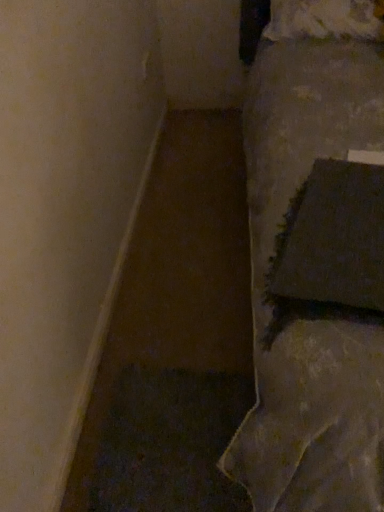
The width and height of the screenshot is (384, 512). I want to click on dark fabric pillow at right, marked as the 1th pillow in a bottom-to-top arrangement, so click(x=337, y=238).

Consider the image. In order to face dark fabric pillow at right, the second pillow in the back-to-front sequence, should I rotate leftwards or rightwards?

Rotate your view right by about 19.527°.

What do you see at coordinates (337, 238) in the screenshot?
I see `dark fabric pillow at right, the first pillow in the front-to-back sequence` at bounding box center [337, 238].

What is the approximate width of dark fabric pillow at right, the first pillow in the front-to-back sequence?

dark fabric pillow at right, the first pillow in the front-to-back sequence, is 15.73 inches wide.

Locate an element on the screen. Image resolution: width=384 pixels, height=512 pixels. white fluffy pillow at upper right, the 1th pillow positioned from the top is located at coordinates (326, 19).

What do you see at coordinates (326, 19) in the screenshot?
I see `white fluffy pillow at upper right, the 1th pillow positioned from the top` at bounding box center [326, 19].

The width and height of the screenshot is (384, 512). Identify the location of dark fabric pillow at right, the 2th pillow when ordered from top to bottom. (337, 238).

Does dark fabric pillow at right, the first pillow in the front-to-back sequence, appear on the left side of white fluffy pillow at upper right, which is the second pillow from front to back?

Correct, you'll find dark fabric pillow at right, the first pillow in the front-to-back sequence, to the left of white fluffy pillow at upper right, which is the second pillow from front to back.

Is dark fabric pillow at right, marked as the 1th pillow in a bottom-to-top arrangement, closer to the viewer compared to white fluffy pillow at upper right, which ranks as the 1th pillow in back-to-front order?

That is True.

Which point is more distant from viewer, (365, 228) or (309, 2)?

Positioned behind is point (309, 2).

From the image's perspective, is dark fabric pillow at right, the second pillow in the back-to-front sequence, located above or below white fluffy pillow at upper right, which is the second pillow from front to back?

From the image's perspective, dark fabric pillow at right, the second pillow in the back-to-front sequence, appears below white fluffy pillow at upper right, which is the second pillow from front to back.

From a real-world perspective, between dark fabric pillow at right, the first pillow in the front-to-back sequence, and white fluffy pillow at upper right, which ranks as the 1th pillow in back-to-front order, who is vertically higher?

In real-world perspective, white fluffy pillow at upper right, which ranks as the 1th pillow in back-to-front order, is above.

Between dark fabric pillow at right, the 2th pillow when ordered from top to bottom, and white fluffy pillow at upper right, which is the second pillow from front to back, which one has larger width?

dark fabric pillow at right, the 2th pillow when ordered from top to bottom, is wider.

Is dark fabric pillow at right, the first pillow in the front-to-back sequence, shorter than white fluffy pillow at upper right, the 1th pillow positioned from the top?

Correct, dark fabric pillow at right, the first pillow in the front-to-back sequence, is not as tall as white fluffy pillow at upper right, the 1th pillow positioned from the top.

Who is smaller, dark fabric pillow at right, the second pillow in the back-to-front sequence, or white fluffy pillow at upper right, which ranks as the 1th pillow in back-to-front order?

dark fabric pillow at right, the second pillow in the back-to-front sequence.

Is dark fabric pillow at right, the first pillow in the front-to-back sequence, located outside white fluffy pillow at upper right, which is the second pillow from front to back?

Indeed, dark fabric pillow at right, the first pillow in the front-to-back sequence, is completely outside white fluffy pillow at upper right, which is the second pillow from front to back.

Does dark fabric pillow at right, the first pillow in the front-to-back sequence, touch white fluffy pillow at upper right, which is the second pillow from front to back?

No, dark fabric pillow at right, the first pillow in the front-to-back sequence, is not next to white fluffy pillow at upper right, which is the second pillow from front to back.

Is dark fabric pillow at right, the second pillow in the back-to-front sequence, positioned with its back to white fluffy pillow at upper right, the 1th pillow positioned from the top?

Absolutely, dark fabric pillow at right, the second pillow in the back-to-front sequence, is directed away from white fluffy pillow at upper right, the 1th pillow positioned from the top.

Can you tell me how much dark fabric pillow at right, the 2th pillow when ordered from top to bottom, and white fluffy pillow at upper right, marked as the second pillow in a bottom-to-top arrangement, differ in facing direction?

17.3 degrees separate the facing orientations of dark fabric pillow at right, the 2th pillow when ordered from top to bottom, and white fluffy pillow at upper right, marked as the second pillow in a bottom-to-top arrangement.

At what (x,y) coordinates should I click in order to perform the action: click on pillow located on the right of dark fabric pillow at right, the second pillow in the back-to-front sequence. Please return your answer as a coordinate pair (x, y). Looking at the image, I should click on (326, 19).

Considering the positions of objects white fluffy pillow at upper right, which ranks as the 1th pillow in back-to-front order, and dark fabric pillow at right, marked as the 1th pillow in a bottom-to-top arrangement, in the image provided, who is more to the left, white fluffy pillow at upper right, which ranks as the 1th pillow in back-to-front order, or dark fabric pillow at right, marked as the 1th pillow in a bottom-to-top arrangement,?

dark fabric pillow at right, marked as the 1th pillow in a bottom-to-top arrangement, is more to the left.

Does white fluffy pillow at upper right, which ranks as the 1th pillow in back-to-front order, come in front of dark fabric pillow at right, the 2th pillow when ordered from top to bottom?

That is False.

Does point (323, 34) come farther from viewer compared to point (365, 294)?

Yes, it is.

From the image's perspective, is white fluffy pillow at upper right, which ranks as the 1th pillow in back-to-front order, under dark fabric pillow at right, marked as the 1th pillow in a bottom-to-top arrangement?

Incorrect, from the image's perspective, white fluffy pillow at upper right, which ranks as the 1th pillow in back-to-front order, is higher than dark fabric pillow at right, marked as the 1th pillow in a bottom-to-top arrangement.

From a real-world perspective, is white fluffy pillow at upper right, the 1th pillow positioned from the top, over dark fabric pillow at right, the 2th pillow when ordered from top to bottom?

Yes, from a real-world perspective, white fluffy pillow at upper right, the 1th pillow positioned from the top, is above dark fabric pillow at right, the 2th pillow when ordered from top to bottom.

Does white fluffy pillow at upper right, which is the second pillow from front to back, have a lesser width compared to dark fabric pillow at right, the second pillow in the back-to-front sequence?

Correct, the width of white fluffy pillow at upper right, which is the second pillow from front to back, is less than that of dark fabric pillow at right, the second pillow in the back-to-front sequence.

Which of these two, white fluffy pillow at upper right, the 1th pillow positioned from the top, or dark fabric pillow at right, the second pillow in the back-to-front sequence, stands shorter?

Standing shorter between the two is dark fabric pillow at right, the second pillow in the back-to-front sequence.

Can you confirm if white fluffy pillow at upper right, which ranks as the 1th pillow in back-to-front order, is smaller than dark fabric pillow at right, the first pillow in the front-to-back sequence?

No, white fluffy pillow at upper right, which ranks as the 1th pillow in back-to-front order, is not smaller than dark fabric pillow at right, the first pillow in the front-to-back sequence.

Is white fluffy pillow at upper right, which ranks as the 1th pillow in back-to-front order, not within dark fabric pillow at right, the 2th pillow when ordered from top to bottom?

That's correct, white fluffy pillow at upper right, which ranks as the 1th pillow in back-to-front order, is outside of dark fabric pillow at right, the 2th pillow when ordered from top to bottom.

Is white fluffy pillow at upper right, which is the second pillow from front to back, far from dark fabric pillow at right, marked as the 1th pillow in a bottom-to-top arrangement?

Absolutely, white fluffy pillow at upper right, which is the second pillow from front to back, is distant from dark fabric pillow at right, marked as the 1th pillow in a bottom-to-top arrangement.

Could you tell me if white fluffy pillow at upper right, marked as the second pillow in a bottom-to-top arrangement, is turned towards dark fabric pillow at right, the first pillow in the front-to-back sequence?

Yes, white fluffy pillow at upper right, marked as the second pillow in a bottom-to-top arrangement, is facing dark fabric pillow at right, the first pillow in the front-to-back sequence.

How distant is white fluffy pillow at upper right, marked as the second pillow in a bottom-to-top arrangement, from dark fabric pillow at right, the first pillow in the front-to-back sequence?

They are 3.90 feet apart.

Locate an element on the screen. The height and width of the screenshot is (512, 384). pillow behind the dark fabric pillow at right, the 2th pillow when ordered from top to bottom is located at coordinates (326, 19).

Locate an element on the screen. This screenshot has height=512, width=384. pillow that appears on the right of dark fabric pillow at right, the first pillow in the front-to-back sequence is located at coordinates (326, 19).

Where is `pillow on the left of white fluffy pillow at upper right, which is the second pillow from front to back`? Image resolution: width=384 pixels, height=512 pixels. pillow on the left of white fluffy pillow at upper right, which is the second pillow from front to back is located at coordinates (337, 238).